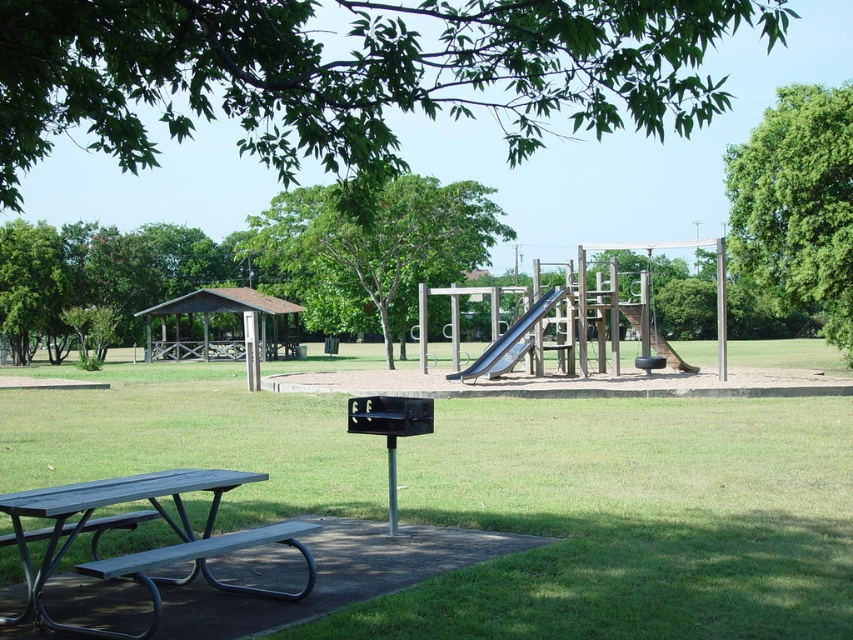
Question: Is green leafy tree at center below metallic smooth slide at center?

Choices:
 (A) yes
 (B) no

Answer: (B)

Question: Does metallic smooth slide at center come in front of smooth gray slide at center?

Choices:
 (A) yes
 (B) no

Answer: (A)

Question: Which point is closer to the camera?

Choices:
 (A) green leafy tree at upper right
 (B) metallic smooth slide at center
 (C) smooth gray slide at center
 (D) green grass at center

Answer: (D)

Question: Which of the following is the closest to the observer?

Choices:
 (A) smooth gray slide at center
 (B) green leafy tree at upper right

Answer: (B)

Question: Is green grass at center smaller than metallic smooth slide at center?

Choices:
 (A) no
 (B) yes

Answer: (A)

Question: Which is farther from the metallic smooth slide at center?

Choices:
 (A) green grass at center
 (B) green leafy tree at center
 (C) smooth gray slide at center
 (D) green leafy tree at upper right

Answer: (B)